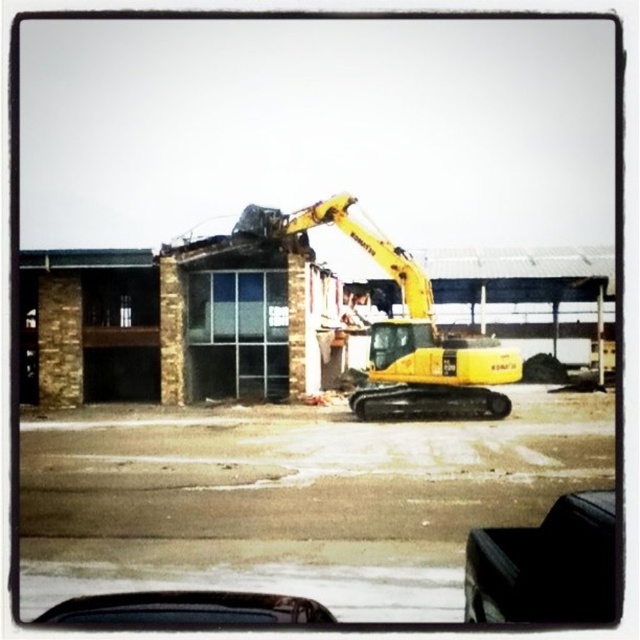
Between point (486, 586) and point (243, 600), which one is positioned in front?

Point (486, 586) is in front.

Which of these two, black leather car at lower right or black matte car at lower center, stands taller?

black leather car at lower right

Who is more forward, (588, 492) or (188, 608)?

Point (188, 608)

Identify the location of black leather car at lower right. The image size is (640, 640). (545, 564).

Can you confirm if yellow rubber excavator at center is bigger than black leather car at lower right?

Indeed, yellow rubber excavator at center has a larger size compared to black leather car at lower right.

Can you confirm if yellow rubber excavator at center is shorter than black leather car at lower right?

No.

Is point (378, 236) in front of point (596, 582)?

No.

This screenshot has height=640, width=640. What are the coordinates of `yellow rubber excavator at center` in the screenshot? It's located at (403, 328).

In the scene shown: Can you confirm if yellow rubber excavator at center is positioned to the left of black matte car at lower center?

No, yellow rubber excavator at center is not to the left of black matte car at lower center.

In the scene shown: Can you confirm if yellow rubber excavator at center is thinner than black matte car at lower center?

Incorrect, yellow rubber excavator at center's width is not less than black matte car at lower center's.

Locate an element on the screen. This screenshot has height=640, width=640. yellow rubber excavator at center is located at coordinates (403, 328).